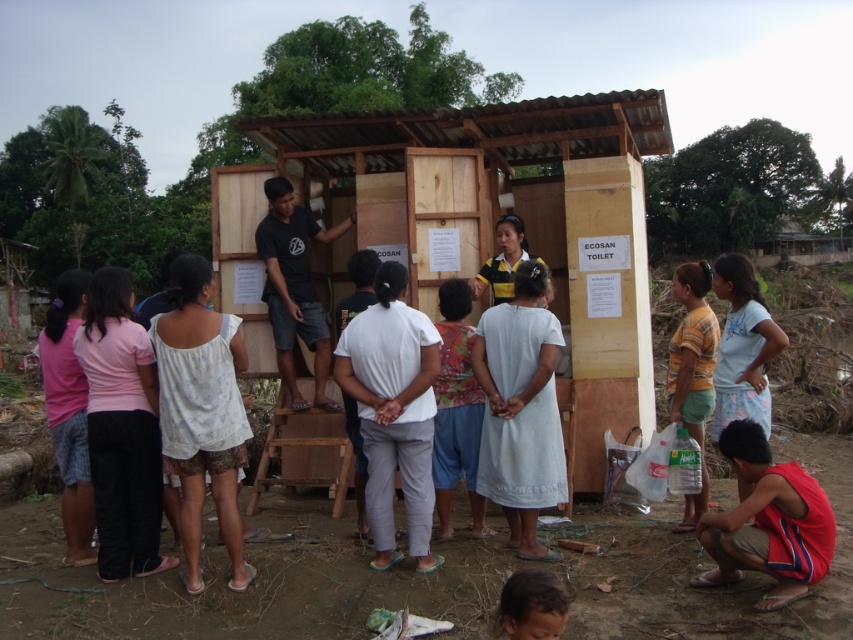
Is yellow-green fabric dress at right behind brown hair at lower center?

That is True.

Which is below, yellow-green fabric dress at right or brown hair at lower center?

Positioned lower is brown hair at lower center.

At what (x,y) coordinates should I click in order to perform the action: click on yellow-green fabric dress at right. Please return your answer as a coordinate pair (x, y). The image size is (853, 640). Looking at the image, I should click on (692, 371).

Consider the image. Does wooden shack at center have a lesser width compared to yellow-green fabric dress at right?

Yes, wooden shack at center is thinner than yellow-green fabric dress at right.

Can you confirm if wooden shack at center is taller than yellow-green fabric dress at right?

No, wooden shack at center is not taller than yellow-green fabric dress at right.

Who is more forward, [625,227] or [682,339]?

Point [682,339] is in front.

Locate an element on the screen. The width and height of the screenshot is (853, 640). wooden shack at center is located at coordinates (517, 211).

Which of these two, wooden shack at center or brown hair at lower center, stands shorter?

With less height is brown hair at lower center.

Does wooden shack at center appear on the left side of brown hair at lower center?

In fact, wooden shack at center is to the right of brown hair at lower center.

Between point (540, 124) and point (561, 618), which one is positioned in front?

Positioned in front is point (561, 618).

Where is `wooden shack at center`? wooden shack at center is located at coordinates (517, 211).